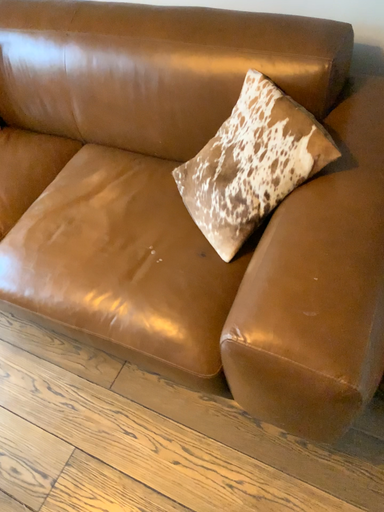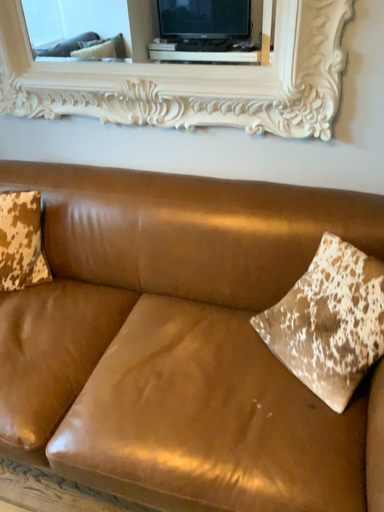
Question: Which way did the camera rotate in the video?

Choices:
 (A) rotated downward
 (B) rotated upward

Answer: (B)